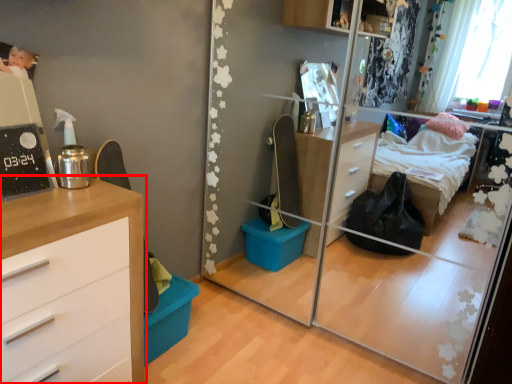
Question: From the image's perspective, considering the relative positions of chest of drawers (annotated by the red box) and mirror in the image provided, where is chest of drawers (annotated by the red box) located with respect to the staircase?

Choices:
 (A) above
 (B) below

Answer: (B)